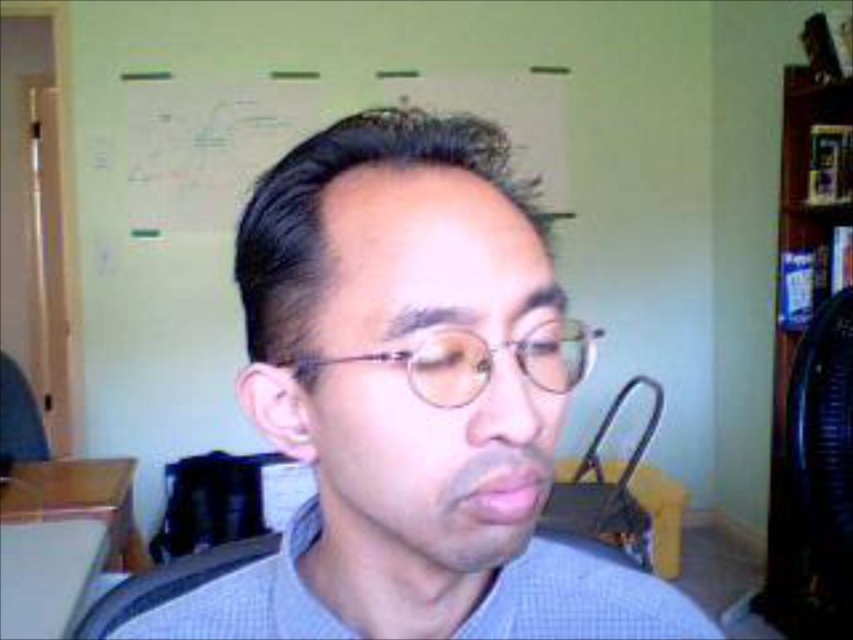
You are a tailor measuring a customer for a custom shirt. You notice the matte glass glasses at center and the blue checkered shirt at center. Which item has a larger height?

The matte glass glasses at center has a greater height compared to the blue checkered shirt at center.

You are trying to determine the best path to reach a specific point in the room. Given the two points marked as point 1 at coordinates point (289,426) and point 2 at coordinates point (770,474), which point is closer to you?

Point (289,426) is closer to the viewer than point (770,474), so you should head towards point (289,426) first.